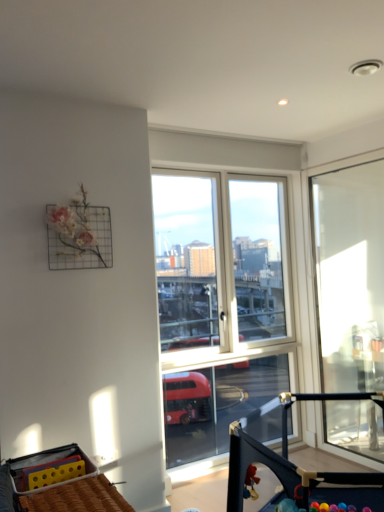
Question: In the image, is black plastic baby carriage at center, the 2th baby carriage when ordered from left to right, positioned in front of or behind yellow plastic baby carriage at lower left, arranged as the first baby carriage when viewed from the left?

Choices:
 (A) front
 (B) behind

Answer: (A)

Question: From a real-world perspective, is black plastic baby carriage at center, the 2th baby carriage when ordered from left to right, positioned above or below yellow plastic baby carriage at lower left, arranged as the first baby carriage when viewed from the left?

Choices:
 (A) below
 (B) above

Answer: (A)

Question: Which object is the farthest from the yellow plastic baby carriage at lower left, arranged as the first baby carriage when viewed from the left?

Choices:
 (A) transparent glass door at right
 (B) black plastic baby carriage at center, arranged as the 1th baby carriage when viewed from the right

Answer: (A)

Question: Which object is positioned closest to the black plastic baby carriage at center, the 2th baby carriage when ordered from left to right?

Choices:
 (A) yellow plastic baby carriage at lower left, which is counted as the second baby carriage, starting from the right
 (B) transparent glass door at right

Answer: (A)